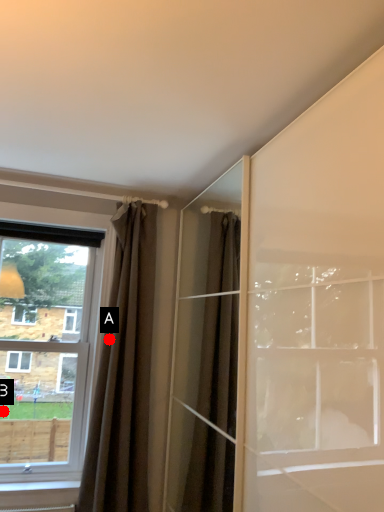
Question: Two points are circled on the image, labeled by A and B beside each circle. Which point is further to the camera?

Choices:
 (A) A is further
 (B) B is further

Answer: (B)